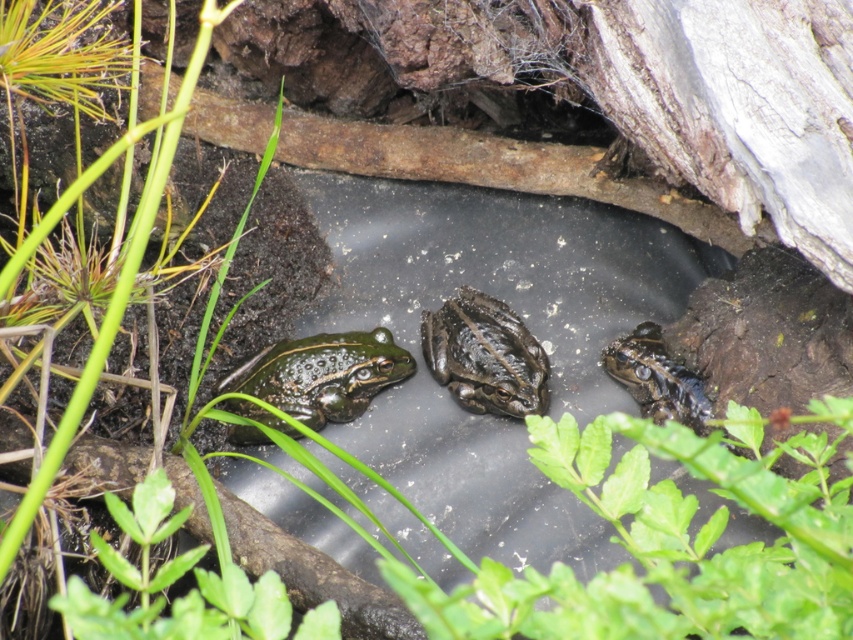
Is green textured frog at center above shiny green frog at center?

Yes.

Where is `green textured frog at center`? green textured frog at center is located at coordinates (485, 355).

Between point (509, 413) and point (610, 364), which one is positioned in front?

Point (509, 413)

The width and height of the screenshot is (853, 640). I want to click on green textured frog at center, so click(x=485, y=355).

Who is positioned more to the left, green shiny skin at center or green textured frog at center?

From the viewer's perspective, green shiny skin at center appears more on the left side.

Who is shorter, green shiny skin at center or green textured frog at center?

Standing shorter between the two is green shiny skin at center.

Does point (345, 336) come farther from viewer compared to point (451, 348)?

Yes, point (345, 336) is behind point (451, 348).

You are a GUI agent. You are given a task and a screenshot of the screen. Output one action in this format:
    pyautogui.click(x=<x>, y=<y>)
    Task: Click on the green shiny skin at center
    
    Given the screenshot: What is the action you would take?
    pyautogui.click(x=322, y=374)

Can you confirm if green shiny skin at center is wider than shiny green frog at center?

Indeed, green shiny skin at center has a greater width compared to shiny green frog at center.

Between point (302, 380) and point (640, 362), which one is positioned in front?

Point (302, 380)

Locate an element on the screen. The image size is (853, 640). green shiny skin at center is located at coordinates (322, 374).